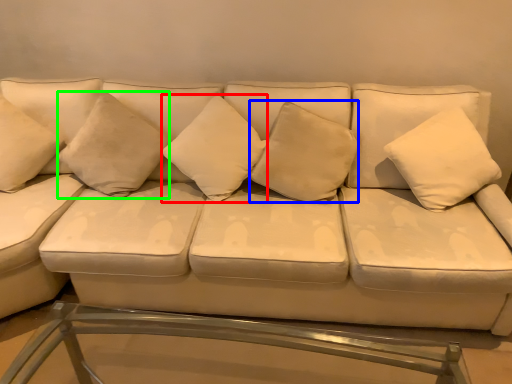
Question: Based on their relative distances, which object is nearer to pillow (highlighted by a red box)? Choose from pillow (highlighted by a blue box) and pillow (highlighted by a green box).

Choices:
 (A) pillow
 (B) pillow

Answer: (A)